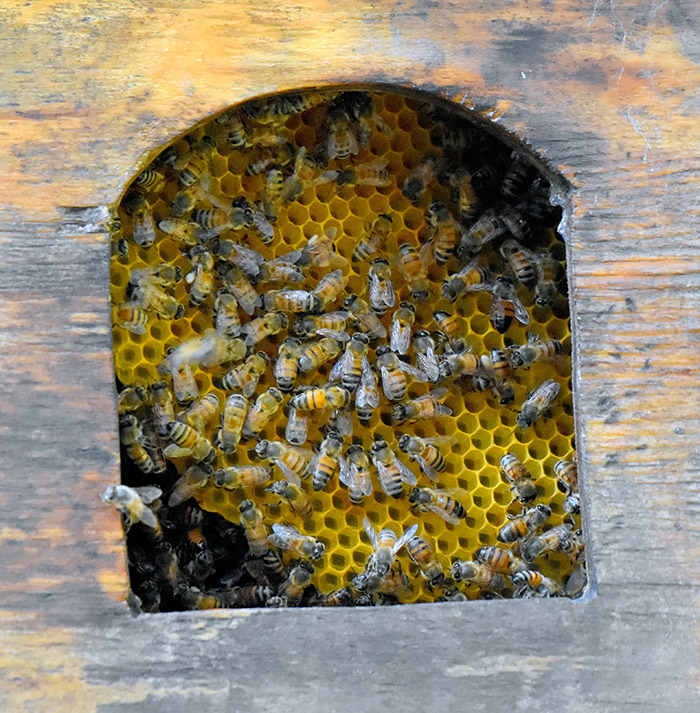
The width and height of the screenshot is (700, 713). In order to click on board in this screenshot , I will do `click(636, 299)`, `click(63, 418)`.